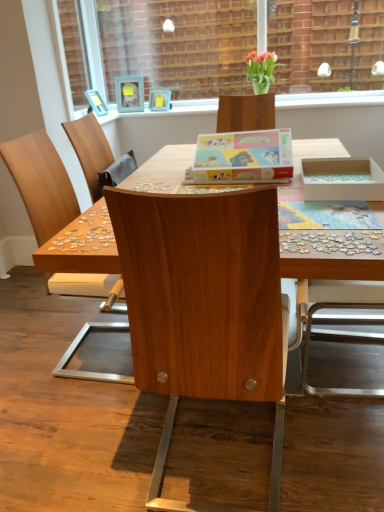
This screenshot has height=512, width=384. In order to click on multicolored plastic puzzle pieces at right in this screenshot , I will do `click(332, 242)`.

Find the location of a particular element. This screenshot has width=384, height=512. matte wooden picture frame at upper center, the 2th picture frame in the left-to-right sequence is located at coordinates (159, 100).

Describe the element at coordinates (78, 247) in the screenshot. This screenshot has height=512, width=384. I see `wooden desk at center` at that location.

The image size is (384, 512). Find the location of `matte cardboard box at center`. matte cardboard box at center is located at coordinates (243, 157).

Is matte cardboard box at center at the back of matte wooden picture frame at upper center, marked as the first picture frame in a right-to-left arrangement?

matte wooden picture frame at upper center, marked as the first picture frame in a right-to-left arrangement, does not have its back to matte cardboard box at center.

Locate an element on the screen. The width and height of the screenshot is (384, 512). the 1st picture frame above the matte cardboard box at center (from a real-world perspective) is located at coordinates (159, 100).

Considering the sizes of matte wooden picture frame at upper center, the 2th picture frame in the left-to-right sequence, and matte cardboard box at center in the image, is matte wooden picture frame at upper center, the 2th picture frame in the left-to-right sequence, bigger or smaller than matte cardboard box at center?

Considering their sizes, matte wooden picture frame at upper center, the 2th picture frame in the left-to-right sequence, takes up less space than matte cardboard box at center.

At what (x,y) coordinates should I click in order to perform the action: click on the 1st picture frame to the left when counting from the matte cardboard box at center. Please return your answer as a coordinate pair (x, y). This screenshot has height=512, width=384. Looking at the image, I should click on (159, 100).

Which of these two, matte cardboard box at center or matte wooden picture frame at upper center, marked as the first picture frame in a right-to-left arrangement, stands taller?

Standing taller between the two is matte cardboard box at center.

In terms of width, does matte cardboard box at center look wider or thinner when compared to matte wooden picture frame at upper center, the 2th picture frame in the left-to-right sequence?

Considering their sizes, matte cardboard box at center looks broader than matte wooden picture frame at upper center, the 2th picture frame in the left-to-right sequence.

Which is more to the left, matte cardboard box at center or matte wooden picture frame at upper center, marked as the first picture frame in a right-to-left arrangement?

matte wooden picture frame at upper center, marked as the first picture frame in a right-to-left arrangement, is more to the left.

Is point (130, 88) positioned in front of point (97, 345)?

No, it is not.

Locate an element on the screen. This screenshot has width=384, height=512. the 2nd picture frame positioned above the wooden chair at center (from a real-world perspective) is located at coordinates (129, 94).

Based on their positions, is wooden photo frame at upper center, which appears as the second picture frame when viewed from the right, located to the left or right of wooden chair at center?

wooden photo frame at upper center, which appears as the second picture frame when viewed from the right, is to the left of wooden chair at center.

Is wooden photo frame at upper center, acting as the first picture frame starting from the left, facing away from wooden chair at center?

No, wooden chair at center is not at the back of wooden photo frame at upper center, acting as the first picture frame starting from the left.

Is wooden chair at center at the right side of multicolored plastic puzzle pieces at right?

Incorrect, wooden chair at center is not on the right side of multicolored plastic puzzle pieces at right.

Does wooden chair at center contain multicolored plastic puzzle pieces at right?

Definitely not — multicolored plastic puzzle pieces at right is not inside wooden chair at center.

Could you tell me if wooden chair at center is facing multicolored plastic puzzle pieces at right?

No.

From the image's perspective, between wooden chair at center and multicolored plastic puzzle pieces at right, which one is located above?

multicolored plastic puzzle pieces at right.

From the image's perspective, does wooden desk at center appear lower than brick wall at upper center?

Indeed, from the image's perspective, wooden desk at center is shown beneath brick wall at upper center.

Is wooden desk at center at the right side of brick wall at upper center?

No, wooden desk at center is not to the right of brick wall at upper center.

You are a GUI agent. You are given a task and a screenshot of the screen. Output one action in this format:
    pyautogui.click(x=<x>, y=<y>)
    Task: Click on the window screen lying on the right of wooden desk at center
    Image resolution: width=384 pixels, height=512 pixels.
    Given the screenshot: What is the action you would take?
    pyautogui.click(x=178, y=44)

Is the position of wooden desk at center more distant than that of brick wall at upper center?

No, wooden desk at center is in front of brick wall at upper center.

From the image's perspective, which one is positioned higher, wooden chair at center or brick wall at upper center?

brick wall at upper center, from the image's perspective.

Are wooden chair at center and brick wall at upper center located far from each other?

Yes, wooden chair at center and brick wall at upper center are quite far apart.

Can we say wooden chair at center lies outside brick wall at upper center?

wooden chair at center lies outside brick wall at upper center's area.

In the image, is wooden chair at center positioned in front of or behind brick wall at upper center?

Visually, wooden chair at center is located in front of brick wall at upper center.

In the image, is wooden frame at upper center on the left side or the right side of multicolored plastic puzzle pieces at right?

Based on their positions, wooden frame at upper center is located to the right of multicolored plastic puzzle pieces at right.

Considering the relative positions of wooden frame at upper center and multicolored plastic puzzle pieces at right in the image provided, is wooden frame at upper center in front of multicolored plastic puzzle pieces at right?

No, wooden frame at upper center is further to the viewer.

Is wooden frame at upper center directly adjacent to multicolored plastic puzzle pieces at right?

There is a gap between wooden frame at upper center and multicolored plastic puzzle pieces at right.

Is point (302, 100) in front of point (318, 232)?

No, it is not.

Find the location of `box in front of the matte wooden picture frame at upper center, the 2th picture frame in the left-to-right sequence`. box in front of the matte wooden picture frame at upper center, the 2th picture frame in the left-to-right sequence is located at coordinates (243, 157).

You are a GUI agent. You are given a task and a screenshot of the screen. Output one action in this format:
    pyautogui.click(x=<x>, y=<y>)
    Task: Click on the 1st picture frame above the matte cardboard box at center (from the image's perspective)
    
    Given the screenshot: What is the action you would take?
    pyautogui.click(x=159, y=100)

Looking at the image, which one is located further to translucent glass vase at upper center, matte cardboard box at center or wooden chair at center?

wooden chair at center is positioned further to the anchor translucent glass vase at upper center.

Considering their positions, is brick wall at upper center positioned further to multicolored plastic puzzle pieces at right than wooden desk at center?

Among the two, brick wall at upper center is located further to multicolored plastic puzzle pieces at right.

From the image, which object appears to be nearer to wooden desk at center, matte wooden picture frame at upper center, the 2th picture frame in the left-to-right sequence, or wooden frame at upper center?

wooden frame at upper center is closer to wooden desk at center.

When comparing their distances from multicolored plastic puzzle pieces at right, does matte cardboard box at center or translucent glass vase at upper center seem further?

translucent glass vase at upper center is positioned further to the anchor multicolored plastic puzzle pieces at right.

Looking at the image, which one is located closer to wooden photo frame at upper center, which appears as the second picture frame when viewed from the right, wooden desk at center or translucent glass vase at upper center?

The object closer to wooden photo frame at upper center, which appears as the second picture frame when viewed from the right, is translucent glass vase at upper center.

Looking at the image, which one is located closer to translucent glass vase at upper center, wooden frame at upper center or matte wooden picture frame at upper center, marked as the first picture frame in a right-to-left arrangement?

The object closer to translucent glass vase at upper center is wooden frame at upper center.

Consider the image. Which object lies nearer to the anchor point translucent glass vase at upper center, wooden photo frame at upper center, which appears as the second picture frame when viewed from the right, or wooden chair at center?

wooden photo frame at upper center, which appears as the second picture frame when viewed from the right, is positioned closer to the anchor translucent glass vase at upper center.

Considering their positions, is wooden chair at center positioned closer to matte cardboard box at center than matte wooden picture frame at upper center, the 2th picture frame in the left-to-right sequence?

Based on the image, wooden chair at center appears to be nearer to matte cardboard box at center.

The height and width of the screenshot is (512, 384). Find the location of `window screen situated between wooden photo frame at upper center, which appears as the second picture frame when viewed from the right, and wooden frame at upper center from left to right`. window screen situated between wooden photo frame at upper center, which appears as the second picture frame when viewed from the right, and wooden frame at upper center from left to right is located at coordinates (178, 44).

Find the location of a particular element. This screenshot has height=512, width=384. floral arrangement between brick wall at upper center and wooden frame at upper center vertically is located at coordinates (261, 70).

The height and width of the screenshot is (512, 384). Find the location of `box positioned between multicolored plastic puzzle pieces at right and translucent glass vase at upper center from near to far`. box positioned between multicolored plastic puzzle pieces at right and translucent glass vase at upper center from near to far is located at coordinates (243, 157).

Identify the location of jigsaw puzzle located between wooden desk at center and brick wall at upper center in the depth direction. Image resolution: width=384 pixels, height=512 pixels. (332, 242).